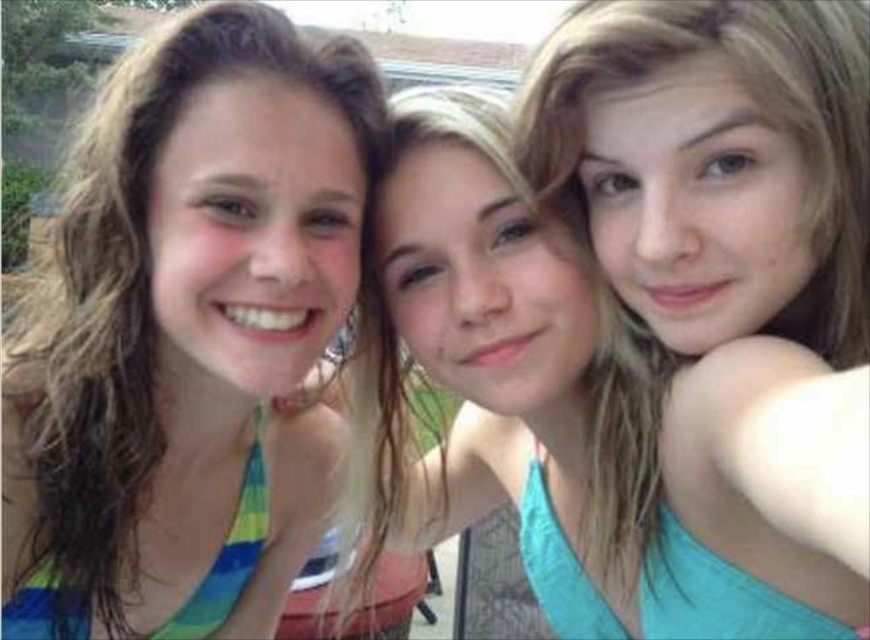
Question: Among these objects, which one is nearest to the camera?

Choices:
 (A) blue striped swimsuit at left
 (B) blonde hair at upper right

Answer: (B)

Question: Is the position of blue striped swimsuit at left less distant than that of blonde hair at upper right?

Choices:
 (A) yes
 (B) no

Answer: (B)

Question: In this image, where is matte teal tank top at center located relative to blonde hair at upper right?

Choices:
 (A) above
 (B) below

Answer: (B)

Question: Which of the following is the closest to the observer?

Choices:
 (A) (853, 172)
 (B) (567, 467)

Answer: (A)

Question: Does blue striped swimsuit at left appear under blonde hair at upper right?

Choices:
 (A) no
 (B) yes

Answer: (B)

Question: Which of the following is the farthest from the observer?

Choices:
 (A) (812, 113)
 (B) (15, 333)

Answer: (B)